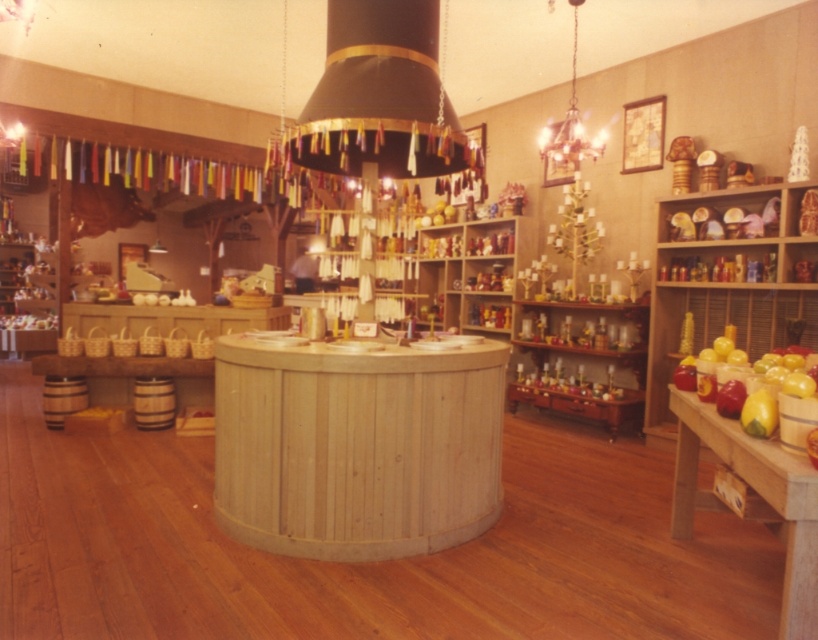
Does natural wood table at center appear on the right side of black fabric chandelier at upper center?

No, natural wood table at center is not to the right of black fabric chandelier at upper center.

This screenshot has width=818, height=640. Identify the location of natural wood table at center. (356, 445).

Is wooden table at right to the left of metallic chandelier at upper center from the viewer's perspective?

Yes, wooden table at right is to the left of metallic chandelier at upper center.

Locate an element on the screen. Image resolution: width=818 pixels, height=640 pixels. wooden table at right is located at coordinates (751, 499).

The height and width of the screenshot is (640, 818). Identify the location of wooden table at right. (751, 499).

Does point (491, 445) lie behind point (598, 148)?

No, it is in front of (598, 148).

Between natural wood table at center and metallic chandelier at upper center, which one appears on the right side from the viewer's perspective?

Positioned to the right is metallic chandelier at upper center.

The height and width of the screenshot is (640, 818). What do you see at coordinates (356, 445) in the screenshot?
I see `natural wood table at center` at bounding box center [356, 445].

Locate an element on the screen. natural wood table at center is located at coordinates (356, 445).